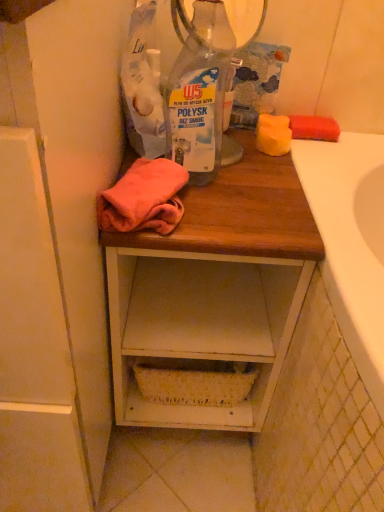
Question: Is white wood cabinet at left thinner than wooden desk at center?

Choices:
 (A) yes
 (B) no

Answer: (B)

Question: Is white wood cabinet at left wider than wooden desk at center?

Choices:
 (A) yes
 (B) no

Answer: (A)

Question: Does white wood cabinet at left have a larger size compared to wooden desk at center?

Choices:
 (A) no
 (B) yes

Answer: (B)

Question: Does white wood cabinet at left have a lesser height compared to wooden desk at center?

Choices:
 (A) yes
 (B) no

Answer: (B)

Question: Is white wood cabinet at left not close to wooden desk at center?

Choices:
 (A) no
 (B) yes

Answer: (A)

Question: Could you tell me if white wood cabinet at left is facing wooden desk at center?

Choices:
 (A) yes
 (B) no

Answer: (B)

Question: From the image's perspective, is transparent plastic bottle at center over white wood cabinet at left?

Choices:
 (A) no
 (B) yes

Answer: (B)

Question: From a real-world perspective, is transparent plastic bottle at center positioned under white wood cabinet at left based on gravity?

Choices:
 (A) no
 (B) yes

Answer: (A)

Question: Is transparent plastic bottle at center to the left of white wood cabinet at left from the viewer's perspective?

Choices:
 (A) yes
 (B) no

Answer: (B)

Question: From a real-world perspective, is transparent plastic bottle at center over white wood cabinet at left?

Choices:
 (A) yes
 (B) no

Answer: (A)

Question: Is the depth of transparent plastic bottle at center less than that of white wood cabinet at left?

Choices:
 (A) yes
 (B) no

Answer: (B)

Question: Considering the relative positions of transparent plastic bottle at center and white wood cabinet at left in the image provided, is transparent plastic bottle at center to the right of white wood cabinet at left from the viewer's perspective?

Choices:
 (A) yes
 (B) no

Answer: (A)

Question: Considering the relative sizes of wooden desk at center and white wood cabinet at left in the image provided, is wooden desk at center smaller than white wood cabinet at left?

Choices:
 (A) yes
 (B) no

Answer: (A)